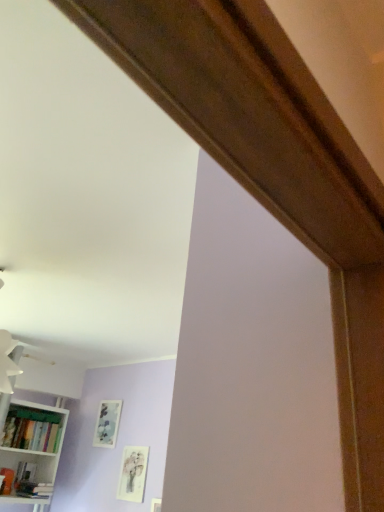
Question: Is matte white picture frame at lower left, the 2th picture frame from the left, looking in the opposite direction of matte silver picture frame at center, placed as the first picture frame when sorted from back to front?

Choices:
 (A) yes
 (B) no

Answer: (B)

Question: From a real-world perspective, is matte white picture frame at lower left, the 2th picture frame from the left, physically above matte silver picture frame at center, the 1th picture frame when ordered from left to right?

Choices:
 (A) yes
 (B) no

Answer: (B)

Question: Is matte white picture frame at lower left, which is the 1th picture frame from right to left, behind matte silver picture frame at center, placed as the first picture frame when sorted from back to front?

Choices:
 (A) yes
 (B) no

Answer: (B)

Question: Is matte white picture frame at lower left, the 2th picture frame when ordered from back to front, positioned before matte silver picture frame at center, which is the second picture frame in right-to-left order?

Choices:
 (A) no
 (B) yes

Answer: (B)

Question: From the image's perspective, does matte white picture frame at lower left, which is the 1th picture frame from right to left, appear higher than matte silver picture frame at center, which is the second picture frame in right-to-left order?

Choices:
 (A) yes
 (B) no

Answer: (B)

Question: Would you consider matte white picture frame at lower left, the 2th picture frame when ordered from back to front, to be distant from matte silver picture frame at center, placed as the first picture frame when sorted from back to front?

Choices:
 (A) no
 (B) yes

Answer: (A)

Question: Considering the relative sizes of white matte bookshelf at lower left and matte white picture frame at lower left, the 2th picture frame when ordered from back to front, in the image provided, is white matte bookshelf at lower left shorter than matte white picture frame at lower left, the 2th picture frame when ordered from back to front,?

Choices:
 (A) no
 (B) yes

Answer: (A)

Question: Is white matte bookshelf at lower left positioned far away from matte white picture frame at lower left, the 2th picture frame from the left?

Choices:
 (A) yes
 (B) no

Answer: (B)

Question: Is white matte bookshelf at lower left completely or partially outside of matte white picture frame at lower left, the 2th picture frame from the left?

Choices:
 (A) no
 (B) yes

Answer: (B)

Question: Considering the relative positions of white matte bookshelf at lower left and matte white picture frame at lower left, which is the 1th picture frame from right to left, in the image provided, is white matte bookshelf at lower left behind matte white picture frame at lower left, which is the 1th picture frame from right to left,?

Choices:
 (A) no
 (B) yes

Answer: (A)

Question: Does white matte bookshelf at lower left have a larger size compared to matte white picture frame at lower left, which is the 1th picture frame from right to left?

Choices:
 (A) no
 (B) yes

Answer: (B)

Question: From the image's perspective, is white matte bookshelf at lower left on top of matte white picture frame at lower left, arranged as the 1th picture frame when viewed from the front?

Choices:
 (A) no
 (B) yes

Answer: (B)

Question: Can you confirm if matte green bookshelf at lower left is shorter than white matte bookshelf at lower left?

Choices:
 (A) no
 (B) yes

Answer: (B)